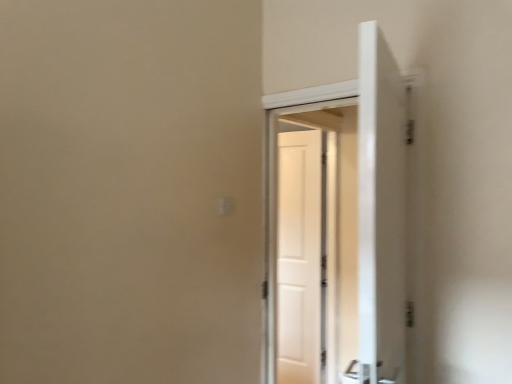
Question: Does white glossy door at center have a smaller size compared to white matte door at center?

Choices:
 (A) yes
 (B) no

Answer: (B)

Question: Is the depth of white glossy door at center greater than that of white matte door at center?

Choices:
 (A) yes
 (B) no

Answer: (B)

Question: From the image's perspective, is white glossy door at center above white matte door at center?

Choices:
 (A) no
 (B) yes

Answer: (B)

Question: Is white glossy door at center at the left side of white matte door at center?

Choices:
 (A) no
 (B) yes

Answer: (B)

Question: From a real-world perspective, is white glossy door at center on top of white matte door at center?

Choices:
 (A) yes
 (B) no

Answer: (A)

Question: Does white glossy door at center have a greater width compared to white matte door at center?

Choices:
 (A) yes
 (B) no

Answer: (A)

Question: Considering the relative positions of white matte door at center and white glossy door at center in the image provided, is white matte door at center to the right of white glossy door at center from the viewer's perspective?

Choices:
 (A) no
 (B) yes

Answer: (B)

Question: Is white matte door at center at the left side of white glossy door at center?

Choices:
 (A) yes
 (B) no

Answer: (B)

Question: Is white matte door at center taller than white glossy door at center?

Choices:
 (A) no
 (B) yes

Answer: (A)

Question: Is white matte door at center closer to the viewer compared to white glossy door at center?

Choices:
 (A) yes
 (B) no

Answer: (B)

Question: From the image's perspective, does white matte door at center appear higher than white glossy door at center?

Choices:
 (A) no
 (B) yes

Answer: (A)

Question: Can you confirm if white matte door at center is smaller than white glossy door at center?

Choices:
 (A) yes
 (B) no

Answer: (A)

Question: In terms of height, does white glossy door at center look taller or shorter compared to white matte door at center?

Choices:
 (A) short
 (B) tall

Answer: (B)